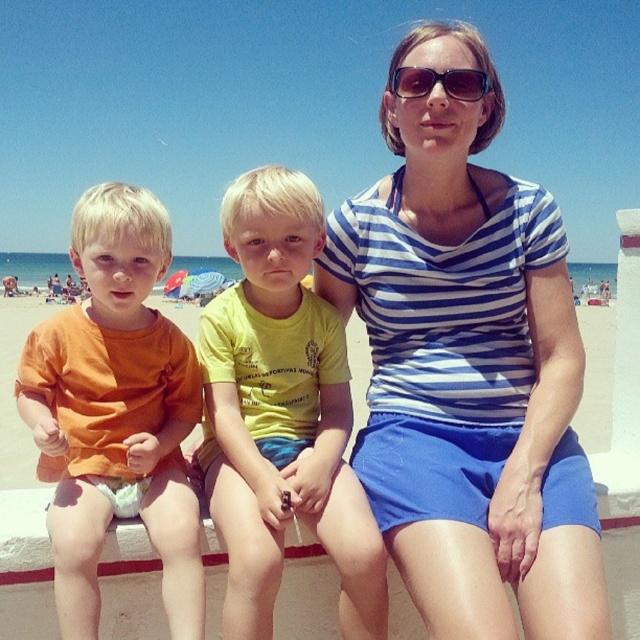
Question: Which of the following is the farthest from the observer?

Choices:
 (A) (476, 80)
 (B) (557, 598)

Answer: (A)

Question: Which point is closer to the camera?

Choices:
 (A) yellow matte shirt at center
 (B) sunglasses at center
 (C) blue striped shirt at center

Answer: (C)

Question: Is blue striped shirt at center positioned behind sunglasses at center?

Choices:
 (A) yes
 (B) no

Answer: (B)

Question: Considering the relative positions of blue striped shirt at center and orange cotton shirt at left in the image provided, where is blue striped shirt at center located with respect to orange cotton shirt at left?

Choices:
 (A) below
 (B) above

Answer: (B)

Question: Which object is closer to the camera taking this photo?

Choices:
 (A) blue striped shirt at center
 (B) orange cotton shirt at left

Answer: (A)

Question: Can you confirm if yellow matte shirt at center is thinner than sunglasses at center?

Choices:
 (A) no
 (B) yes

Answer: (A)